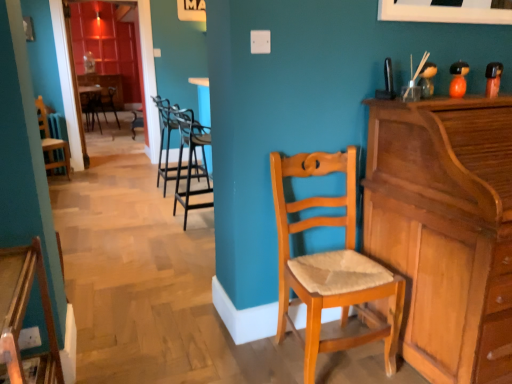
In order to click on free spot below wooden chair at left, which is counted as the 5th chair, starting from the front (from a real-world perspective) in this screenshot , I will do `click(58, 180)`.